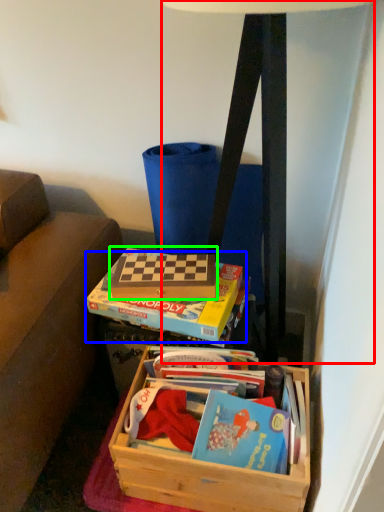
Question: Based on their relative distances, which object is farther from table lamp (highlighted by a red box)? Choose from paperback book (highlighted by a blue box) and paperback book (highlighted by a green box).

Choices:
 (A) paperback book
 (B) paperback book

Answer: (A)